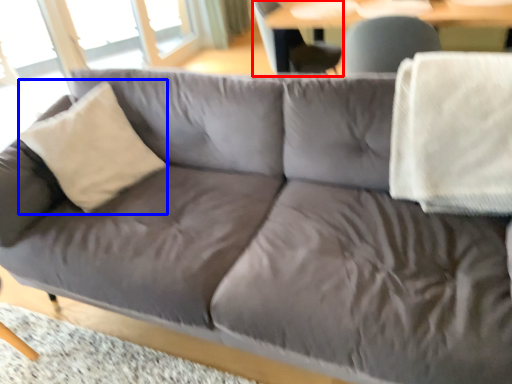
Question: Which of the following is the farthest to the observer, swivel chair (highlighted by a red box) or throw pillow (highlighted by a blue box)?

Choices:
 (A) swivel chair
 (B) throw pillow

Answer: (A)